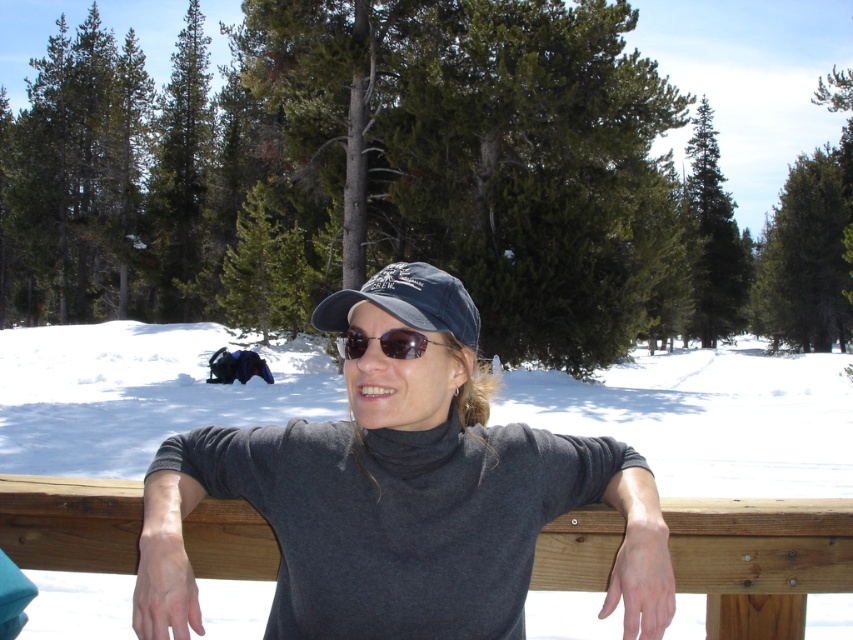
Is gray matte turtleneck at center closer to the viewer compared to brown wooden rail at center?

Yes, it is.

Is gray matte turtleneck at center to the right of brown wooden rail at center from the viewer's perspective?

Yes, gray matte turtleneck at center is to the right of brown wooden rail at center.

Does point (524, 540) lie behind point (602, 572)?

No, it is in front of (602, 572).

You are a GUI agent. You are given a task and a screenshot of the screen. Output one action in this format:
    pyautogui.click(x=<x>, y=<y>)
    Task: Click on the gray matte turtleneck at center
    The width and height of the screenshot is (853, 640).
    Given the screenshot: What is the action you would take?
    pyautogui.click(x=401, y=493)

Can you confirm if dark blue fabric cap at center is taller than sunglasses at center?

Indeed, dark blue fabric cap at center has a greater height compared to sunglasses at center.

Which is behind, point (453, 324) or point (402, 342)?

Point (453, 324)

I want to click on dark blue fabric cap at center, so click(x=407, y=301).

Does gray matte turtleneck at center have a greater width compared to dark blue fabric cap at center?

Yes.

Between point (485, 410) and point (432, 269), which one is positioned behind?

Positioned behind is point (485, 410).

Locate an element on the screen. gray matte turtleneck at center is located at coordinates (401, 493).